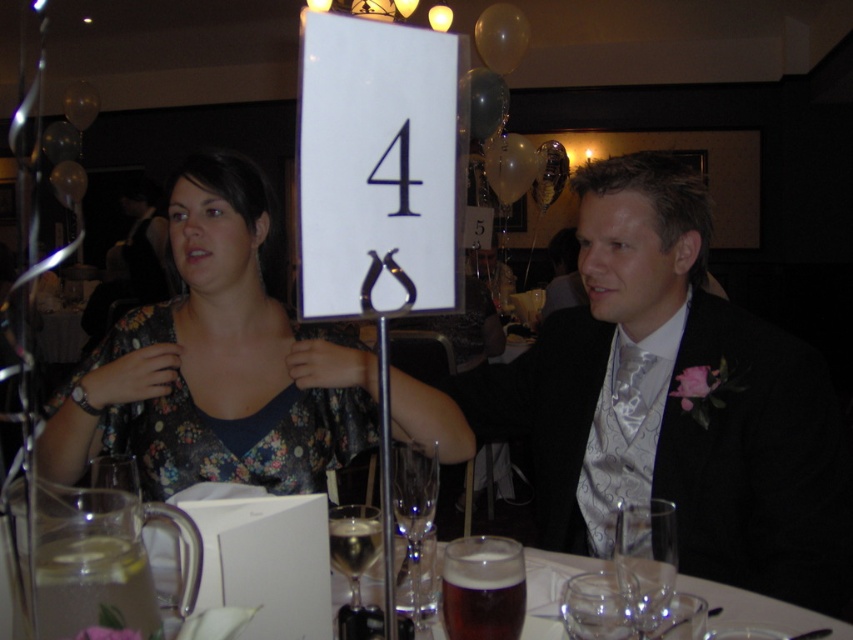
From the picture: Who is more forward, (730, 428) or (424, 509)?

Point (424, 509)

Consider the image. Who is more forward, (782, 436) or (428, 609)?

Point (428, 609)

Identify the location of silvery satin suit at right. The height and width of the screenshot is (640, 853). (675, 403).

Does floral dress at center lie behind transparent glass at lower center?

No, it is in front of transparent glass at lower center.

Who is more distant from viewer, (241, 420) or (628, 618)?

The point (241, 420) is behind.

Locate an element on the screen. This screenshot has width=853, height=640. floral dress at center is located at coordinates (216, 364).

Does point (453, 609) lie in front of point (352, 554)?

Yes, it is in front of point (352, 554).

Which is more to the right, dark amber glass at lower center or clear glass wine glass at lower center?

dark amber glass at lower center

Where is `dark amber glass at lower center`? dark amber glass at lower center is located at coordinates (482, 588).

You are a GUI agent. You are given a task and a screenshot of the screen. Output one action in this format:
    pyautogui.click(x=<x>, y=<y>)
    Task: Click on the dark amber glass at lower center
    This screenshot has height=640, width=853.
    Given the screenshot: What is the action you would take?
    pyautogui.click(x=482, y=588)